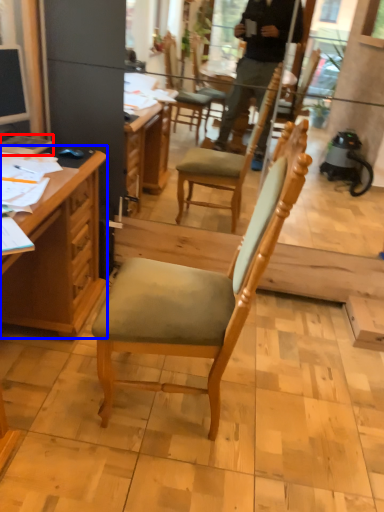
Question: Which of the following is the closest to the observer, book (highlighted by a red box) or desk (highlighted by a blue box)?

Choices:
 (A) book
 (B) desk

Answer: (B)